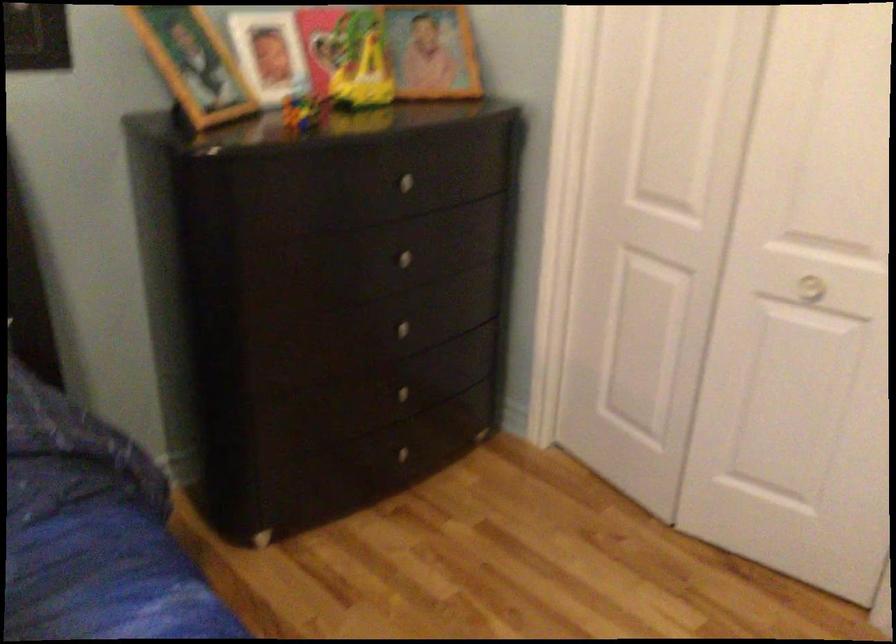
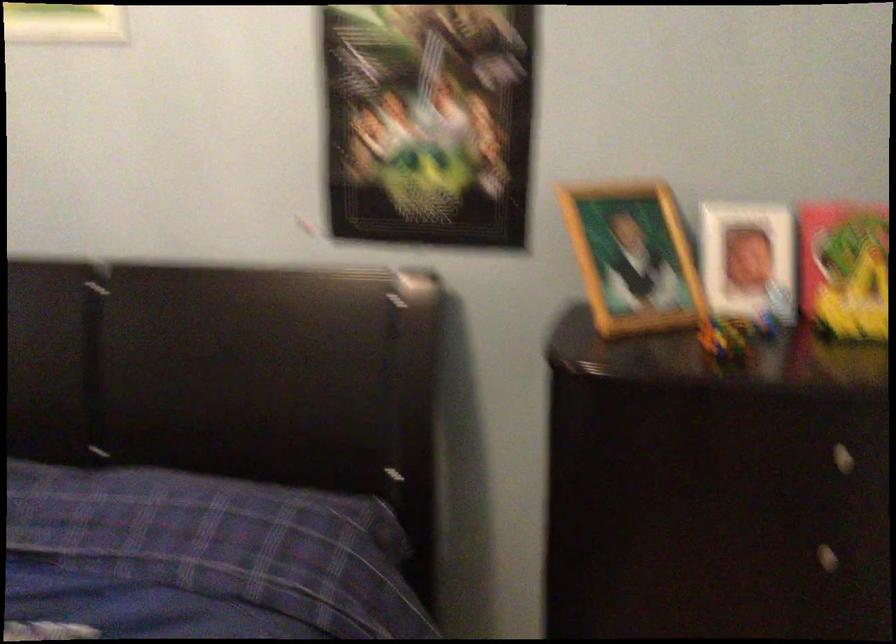
Question: The camera is either moving clockwise (left) or counter-clockwise (right) around the object. The first image is from the beginning of the video and the second image is from the end. Is the camera moving left or right when shooting the video?

Choices:
 (A) Left
 (B) Right

Answer: (B)